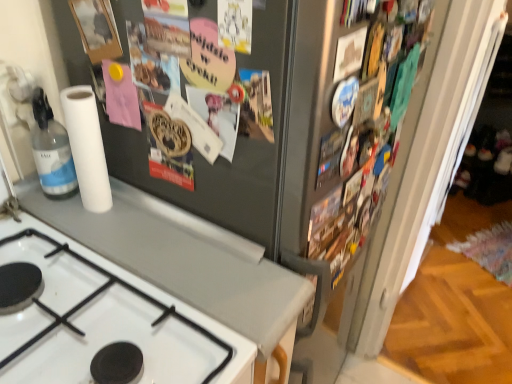
Question: Considering the positions of white glossy gas stove at lower left and white matte paper towel at left in the image, is white glossy gas stove at lower left taller or shorter than white matte paper towel at left?

Choices:
 (A) short
 (B) tall

Answer: (A)

Question: In terms of size, does white glossy gas stove at lower left appear bigger or smaller than white matte paper towel at left?

Choices:
 (A) big
 (B) small

Answer: (A)

Question: From the image's perspective, relative to white matte paper towel at left, is white glossy gas stove at lower left above or below?

Choices:
 (A) above
 (B) below

Answer: (B)

Question: In the image, is white matte paper towel at left positioned in front of or behind white glossy gas stove at lower left?

Choices:
 (A) behind
 (B) front

Answer: (A)

Question: Is white matte paper towel at left bigger or smaller than white glossy gas stove at lower left?

Choices:
 (A) small
 (B) big

Answer: (A)

Question: From a real-world perspective, is white matte paper towel at left above or below white glossy gas stove at lower left?

Choices:
 (A) above
 (B) below

Answer: (A)

Question: From the image's perspective, is white matte paper towel at left located above or below white glossy gas stove at lower left?

Choices:
 (A) below
 (B) above

Answer: (B)